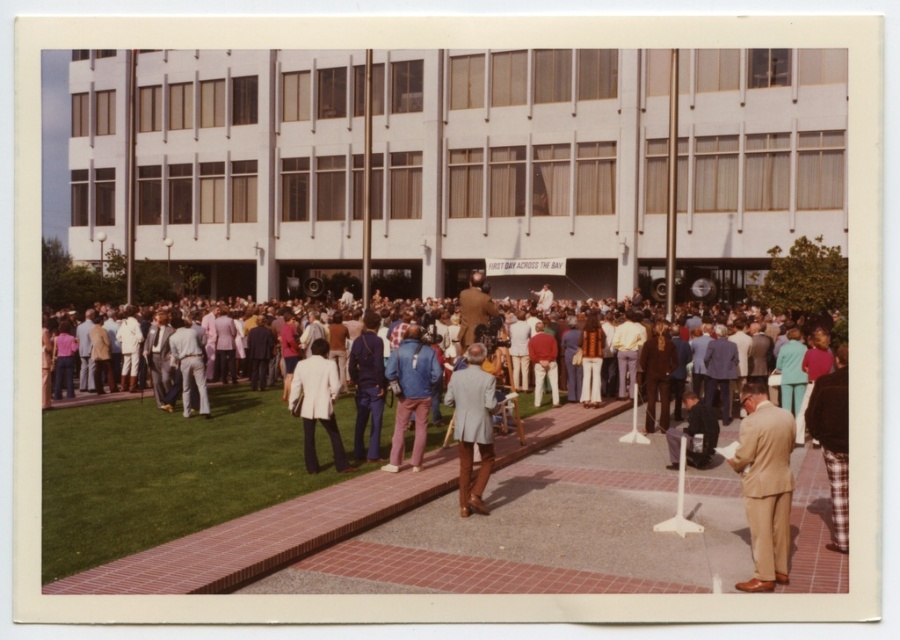
You are standing at the point with coordinates [472,426] in the image. What is the nearest object to you?

The nearest object to you is the light gray suit at center, as the point coordinates directly correspond to its location.

You are organizing a photo shoot and need to ensure that all attire items are visible in the frame. Given that the camera can only focus on objects within a 3 meter diameter, will both the multicolored casual attire at center and the tan suit at lower right fit within this focus area?

The multicolored casual attire at center is bigger than the tan suit at lower right, but the camera can focus on objects within a 3 meter diameter. Since both items are within the same general area described as the center and lower right of the scene, they should fit within the focus area.

You are standing at the entrance of the building and want to greet both the person wearing the tan suit at lower right and the person in the white textured blazer at center. If you walk straight ahead, which person will you reach first?

The tan suit at lower right is 18.35 feet away from the white textured blazer at center. Since you are at the entrance, walking straight ahead, you would reach the white textured blazer at center first before reaching the tan suit at lower right, assuming the blazer is closer to the entrance path.